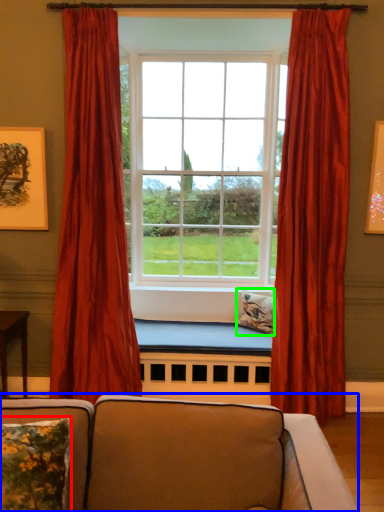
Question: Estimate the real-world distances between objects in this image. Which object is farther from pillow (highlighted by a red box), studio couch (highlighted by a blue box) or pillow (highlighted by a green box)?

Choices:
 (A) studio couch
 (B) pillow

Answer: (B)